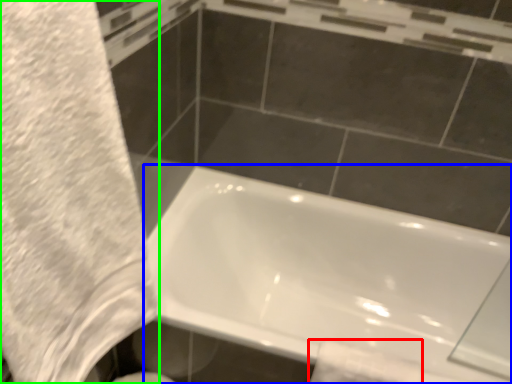
Question: Which object is positioned farthest from toilet paper (highlighted by a red box)? Select from bathtub (highlighted by a blue box) and bath towel (highlighted by a green box).

Choices:
 (A) bathtub
 (B) bath towel

Answer: (B)